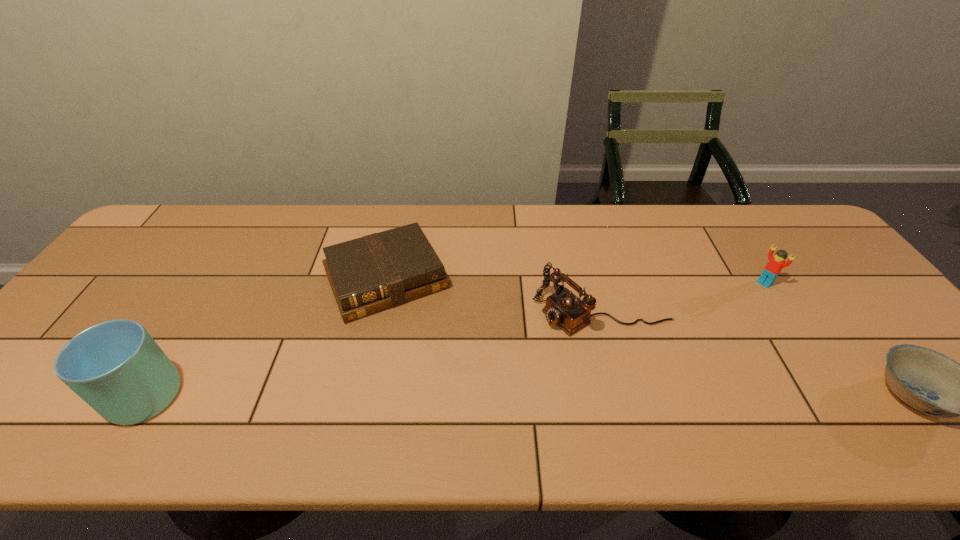
You are a GUI agent. You are given a task and a screenshot of the screen. Output one action in this format:
    pyautogui.click(x=<x>, y=<y>)
    Task: Click on the mug
    The height and width of the screenshot is (540, 960).
    Given the screenshot: What is the action you would take?
    pyautogui.click(x=116, y=367)

The image size is (960, 540). I want to click on the leftmost object, so click(x=116, y=367).

Identify the location of telephone. This screenshot has height=540, width=960. (570, 313).

This screenshot has height=540, width=960. Find the location of `Bible`. Bible is located at coordinates (381, 270).

Find the location of a particular element. the second object from right to left is located at coordinates (773, 268).

At what (x,y) coordinates should I click in order to perform the action: click on free space located 0.180m on the back of the leftmost object. Please return your answer as a coordinate pair (x, y). Looking at the image, I should click on (191, 309).

What are the coordinates of `free space located on the dial of the telephone` in the screenshot? It's located at (417, 404).

Image resolution: width=960 pixels, height=540 pixels. Identify the location of free point located on the dial of the telephone. (455, 381).

This screenshot has width=960, height=540. What are the coordinates of `vacant space located 0.110m on the dial of the telephone` in the screenshot? It's located at (514, 346).

Find the location of a particular element. vacant space located 0.060m on the spine side of the Bible is located at coordinates (418, 336).